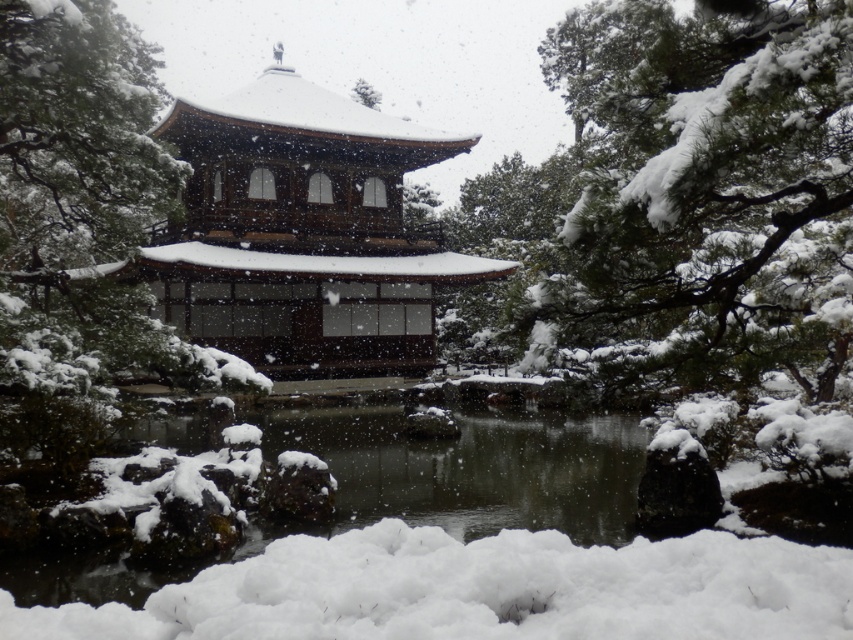
Question: Is green textured pine tree at upper right bigger than white fluffy snow at upper center?

Choices:
 (A) yes
 (B) no

Answer: (A)

Question: Is green textured pine tree at upper right positioned behind white fluffy snow at upper center?

Choices:
 (A) no
 (B) yes

Answer: (A)

Question: Considering the relative positions of green textured pine tree at upper right and white fluffy snow at upper center in the image provided, where is green textured pine tree at upper right located with respect to white fluffy snow at upper center?

Choices:
 (A) below
 (B) above

Answer: (A)

Question: Which of these objects is positioned closest to the green textured pine tree at upper right?

Choices:
 (A) white fluffy snow at upper center
 (B) white smooth pond at center

Answer: (B)

Question: Among these points, which one is farthest from the camera?

Choices:
 (A) (671, 250)
 (B) (379, 96)

Answer: (B)

Question: Based on their relative distances, which object is farther from the white fluffy snow at upper center?

Choices:
 (A) white smooth pond at center
 (B) green textured pine tree at upper right

Answer: (A)